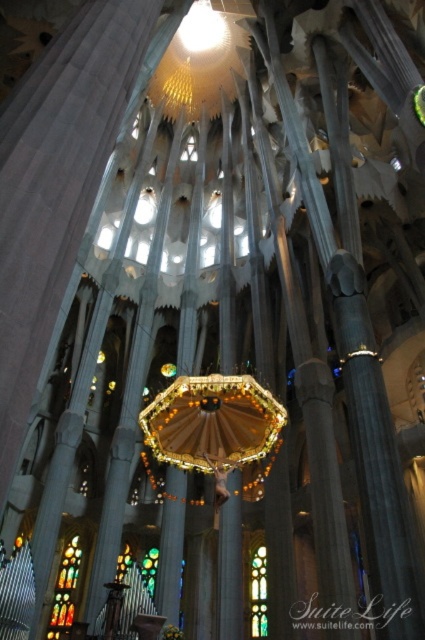
Question: Which point is farther to the camera?

Choices:
 (A) stained glass window at lower left
 (B) multicolored stained glass at center

Answer: (B)

Question: Considering the relative positions of stained glass window at lower left and multicolored stained glass at center in the image provided, where is stained glass window at lower left located with respect to multicolored stained glass at center?

Choices:
 (A) above
 (B) below

Answer: (A)

Question: Is stained glass window at lower left behind multicolored stained glass at center?

Choices:
 (A) no
 (B) yes

Answer: (A)

Question: Is stained glass window at lower left to the left of multicolored stained glass at center from the viewer's perspective?

Choices:
 (A) yes
 (B) no

Answer: (A)